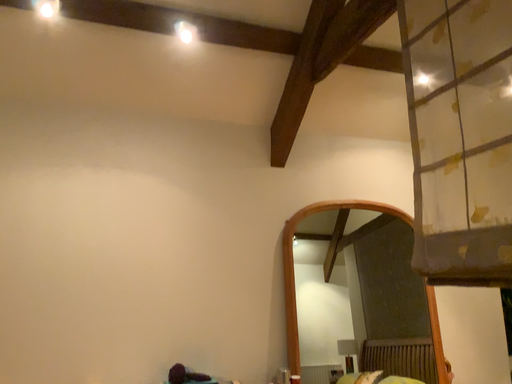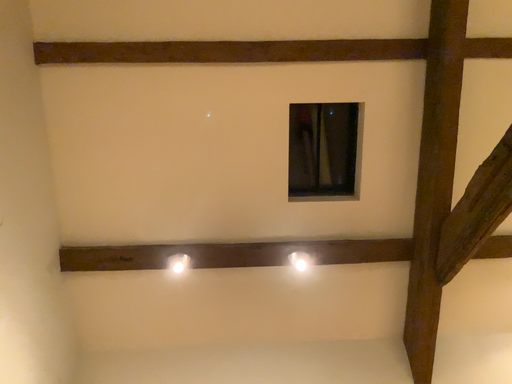
Question: Which way did the camera rotate in the video?

Choices:
 (A) rotated downward
 (B) rotated upward

Answer: (B)